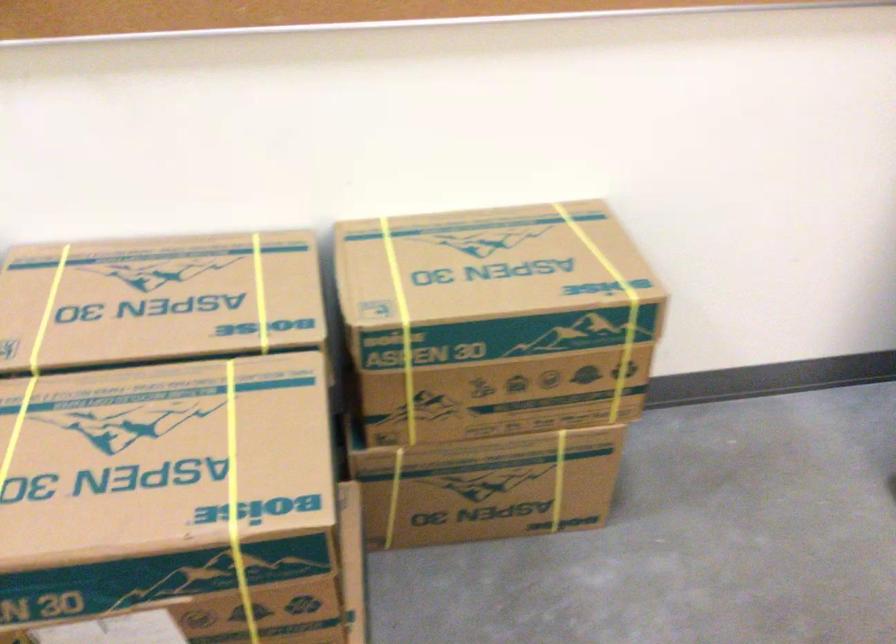
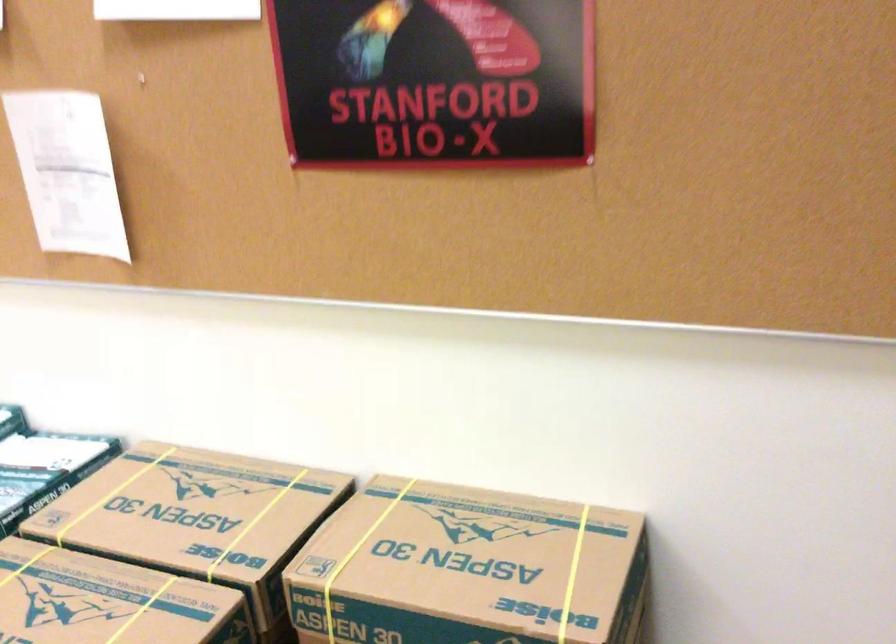
Locate, in the second image, the point that corresponds to (x=185, y=404) in the first image.

(108, 601)